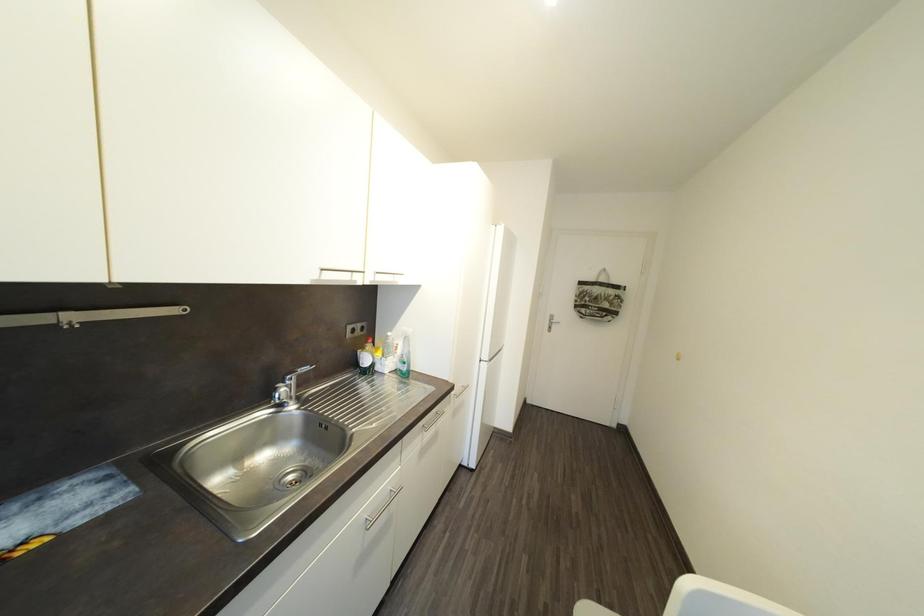
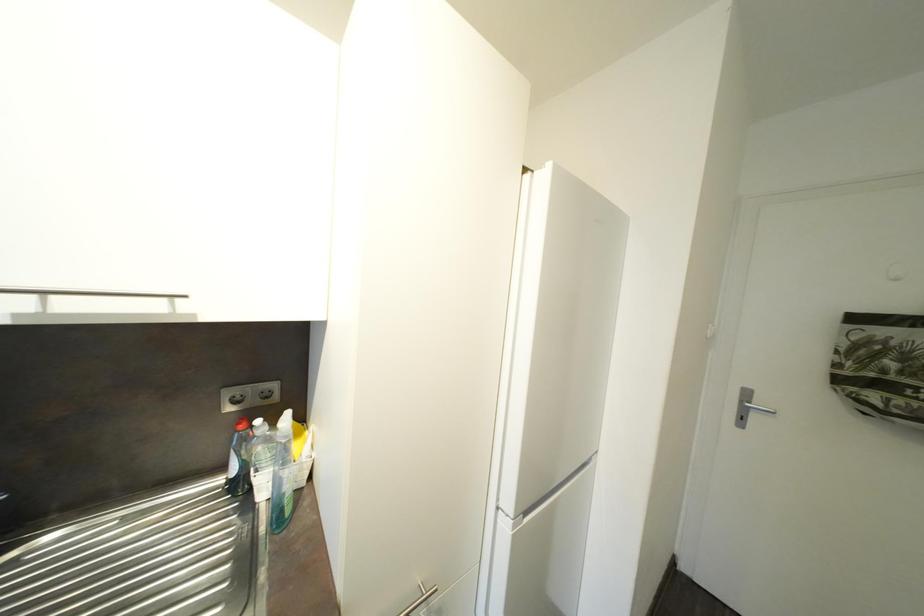
Which direction would the cameraman need to move to produce the second image?

The cameraman walked toward right, forward.